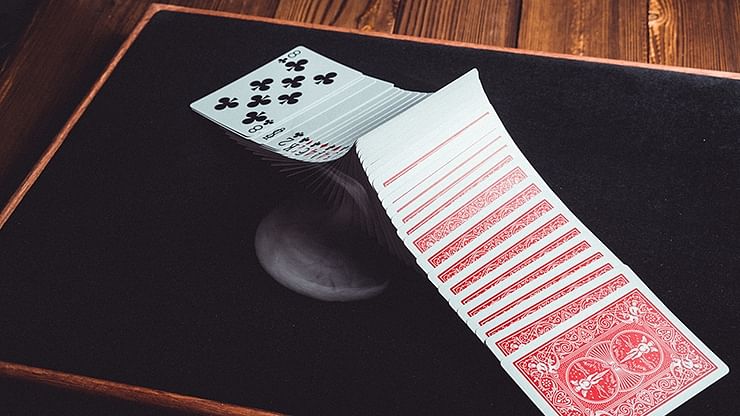
The height and width of the screenshot is (416, 740). Find the location of `floor`. floor is located at coordinates (608, 38), (437, 1), (30, 70).